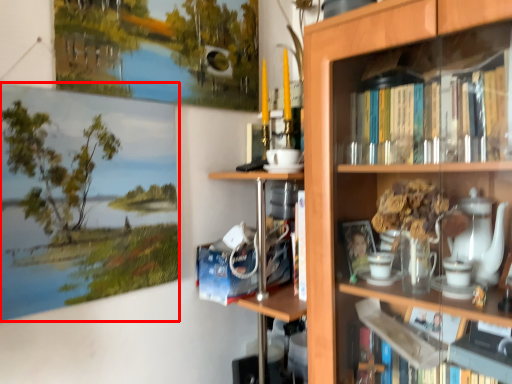
Question: Observing the image, what is the correct spatial positioning of picture frame (annotated by the red box) in reference to bookcase?

Choices:
 (A) right
 (B) left

Answer: (B)